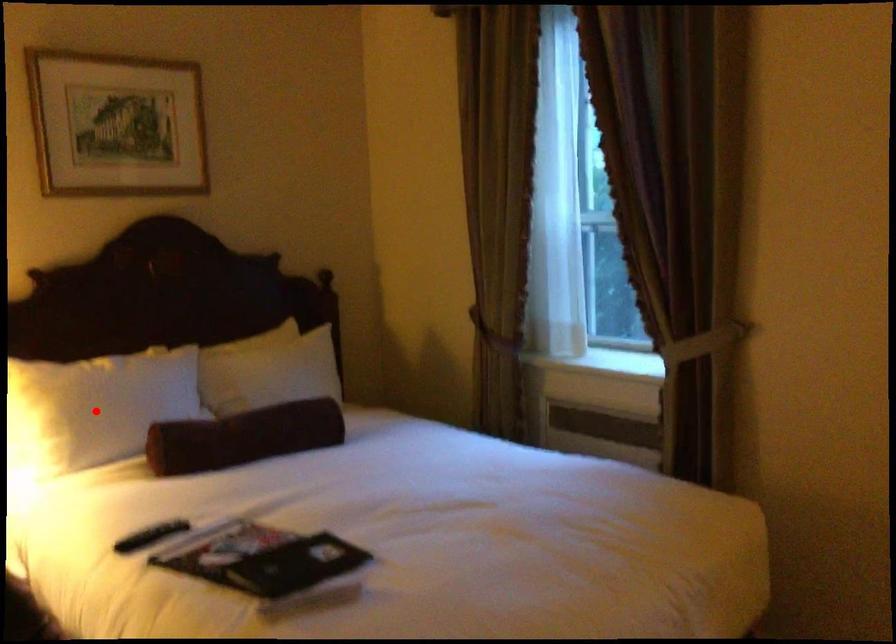
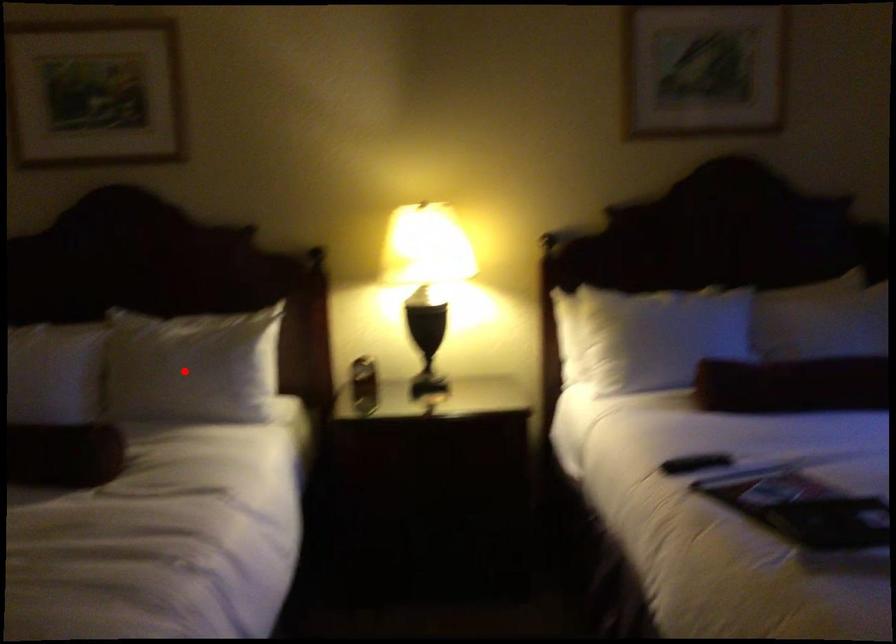
I am providing you with two images of the same scene from different viewpoints. A red point is marked on the first image and another point is marked on the second image. Are the points marked in image1 and image2 representing the same 3D position?

No